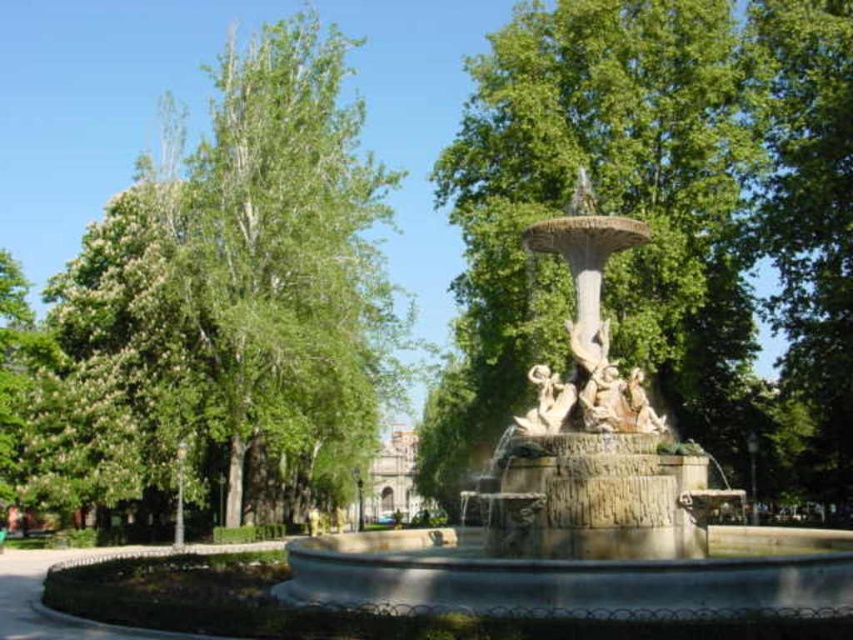
Is green leafy tree at left above carved stone figures at center?

Correct, green leafy tree at left is located above carved stone figures at center.

You are a GUI agent. You are given a task and a screenshot of the screen. Output one action in this format:
    pyautogui.click(x=<x>, y=<y>)
    Task: Click on the green leafy tree at left
    
    Given the screenshot: What is the action you would take?
    pyautogui.click(x=221, y=307)

Does green leafy tree at left have a greater height compared to white marble statue at center?

Correct, green leafy tree at left is much taller as white marble statue at center.

Which is more to the right, green leafy tree at left or white marble statue at center?

Positioned to the right is white marble statue at center.

Is point (68, 288) farther from camera compared to point (547, 397)?

Yes.

You are a GUI agent. You are given a task and a screenshot of the screen. Output one action in this format:
    pyautogui.click(x=<x>, y=<y>)
    Task: Click on the green leafy tree at left
    
    Given the screenshot: What is the action you would take?
    point(221,307)

Based on the photo, can you confirm if stone fountain at center is bigger than carved stone figures at center?

Yes.

You are a GUI agent. You are given a task and a screenshot of the screen. Output one action in this format:
    pyautogui.click(x=<x>, y=<y>)
    Task: Click on the stone fountain at center
    
    Given the screenshot: What is the action you would take?
    [x=581, y=541]

The width and height of the screenshot is (853, 640). Identify the location of stone fountain at center. (581, 541).